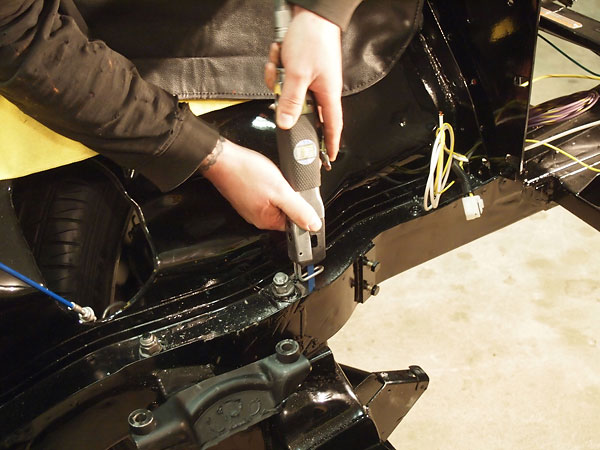
Identify the location of wires. (591, 165), (556, 135), (440, 178), (434, 180), (65, 299).